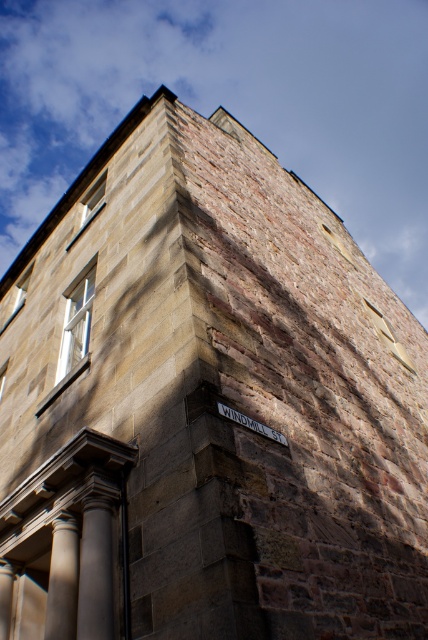
You are standing in front of the building on Windmill St. You notice a point marked at coordinates [62,579]. Based on the scene description, what architectural feature does this point most likely correspond to?

The point at coordinates [62,579] corresponds to the smooth stone column at lower left.

You are standing at the corner of WINDMILL ST, looking at the building. Where is the smooth stone column at lower left located in terms of coordinates?

The smooth stone column at lower left is located at coordinates point [62,579].